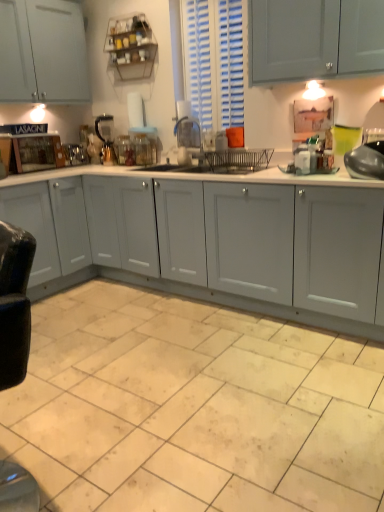
You are a GUI agent. You are given a task and a screenshot of the screen. Output one action in this format:
    pyautogui.click(x=<x>, y=<y>)
    Task: Click on the vacant space situated above beige ceramic tile at lower center (from a real-world perspective)
    This screenshot has width=384, height=512.
    Given the screenshot: What is the action you would take?
    pyautogui.click(x=166, y=386)